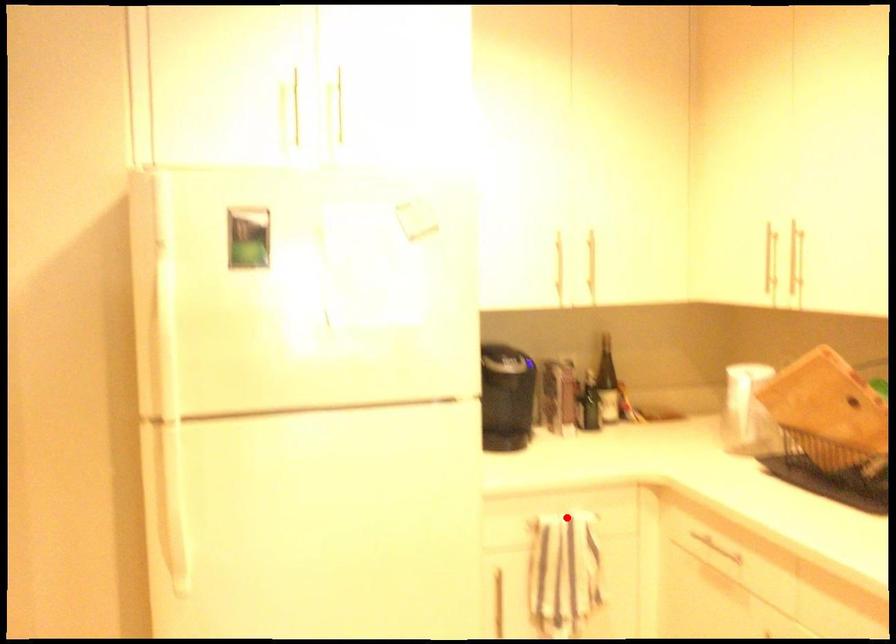
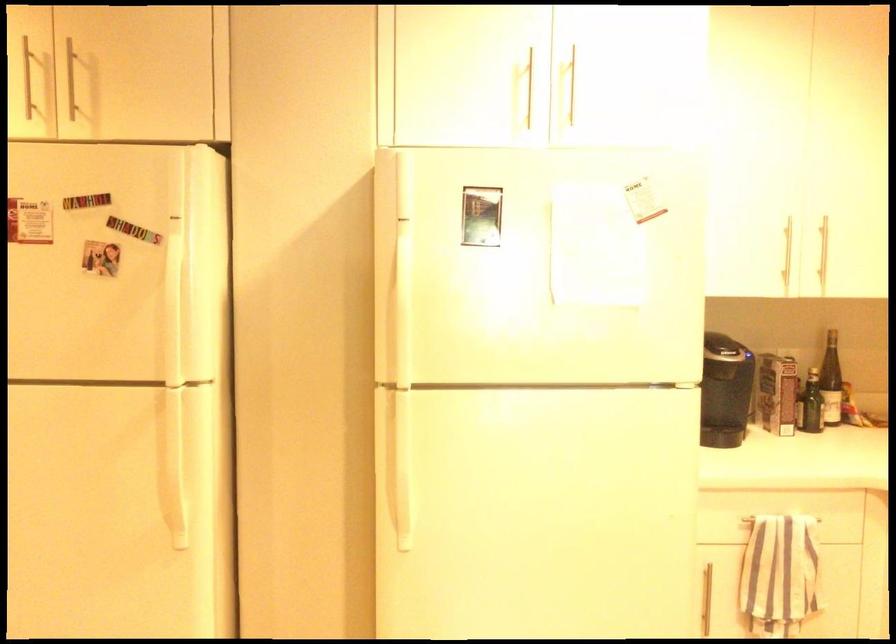
In the second image, find the point that corresponds to the highlighted location in the first image.

(781, 518)